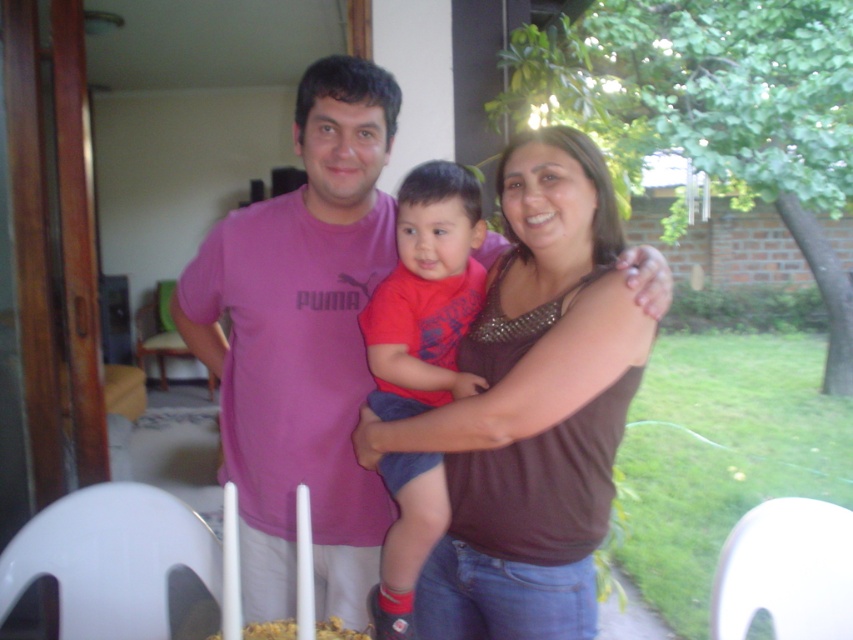
Does pink cotton t-shirt at center have a smaller size compared to red cotton shirt at center?

No, pink cotton t-shirt at center is not smaller than red cotton shirt at center.

The width and height of the screenshot is (853, 640). Describe the element at coordinates (302, 344) in the screenshot. I see `pink cotton t-shirt at center` at that location.

You are a GUI agent. You are given a task and a screenshot of the screen. Output one action in this format:
    pyautogui.click(x=<x>, y=<y>)
    Task: Click on the pink cotton t-shirt at center
    
    Given the screenshot: What is the action you would take?
    pyautogui.click(x=302, y=344)

Does brown textured tank top at center have a lesser width compared to red cotton shirt at center?

Incorrect, brown textured tank top at center's width is not less than red cotton shirt at center's.

Is brown textured tank top at center taller than red cotton shirt at center?

Correct, brown textured tank top at center is much taller as red cotton shirt at center.

Which is behind, point (606, 323) or point (374, 346)?

Point (374, 346)

Find the location of a particular element. This screenshot has height=640, width=853. brown textured tank top at center is located at coordinates (532, 408).

Between point (425, 422) and point (335, 561), which one is positioned in front?

Positioned in front is point (425, 422).

Which is in front, point (515, 330) or point (306, 202)?

Point (515, 330) is more forward.

Identify the location of brown textured tank top at center. point(532,408).